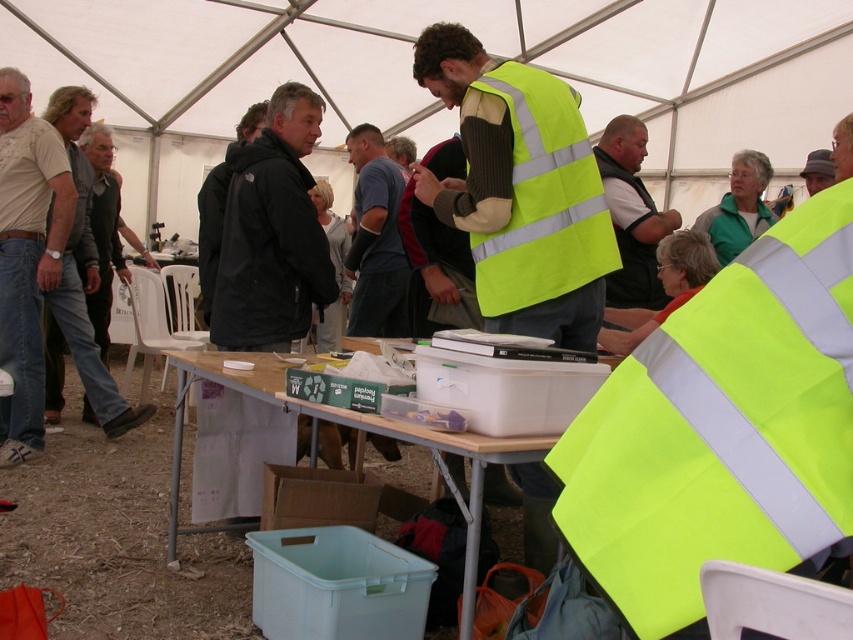
Can you confirm if neon yellow reflective vest at center is positioned above wooden table at center?

Yes, neon yellow reflective vest at center is above wooden table at center.

Who is positioned more to the right, neon yellow reflective vest at center or wooden table at center?

Positioned to the right is neon yellow reflective vest at center.

Is point (569, 221) in front of point (372, 416)?

No, it is behind (372, 416).

At what (x,y) coordinates should I click in order to perform the action: click on neon yellow reflective vest at center. Please return your answer as a coordinate pair (x, y). Looking at the image, I should click on [x=543, y=198].

Is neon yellow reflective vest at center below matte beige t-shirt at left?

Actually, neon yellow reflective vest at center is above matte beige t-shirt at left.

You are a GUI agent. You are given a task and a screenshot of the screen. Output one action in this format:
    pyautogui.click(x=<x>, y=<y>)
    Task: Click on the neon yellow reflective vest at center
    The image size is (853, 640).
    Given the screenshot: What is the action you would take?
    pyautogui.click(x=543, y=198)

Between point (599, 182) and point (376, 236), which one is positioned in front?

Point (599, 182)

Which is behind, point (566, 122) or point (357, 193)?

Point (357, 193)

The height and width of the screenshot is (640, 853). I want to click on neon yellow reflective vest at center, so click(x=543, y=198).